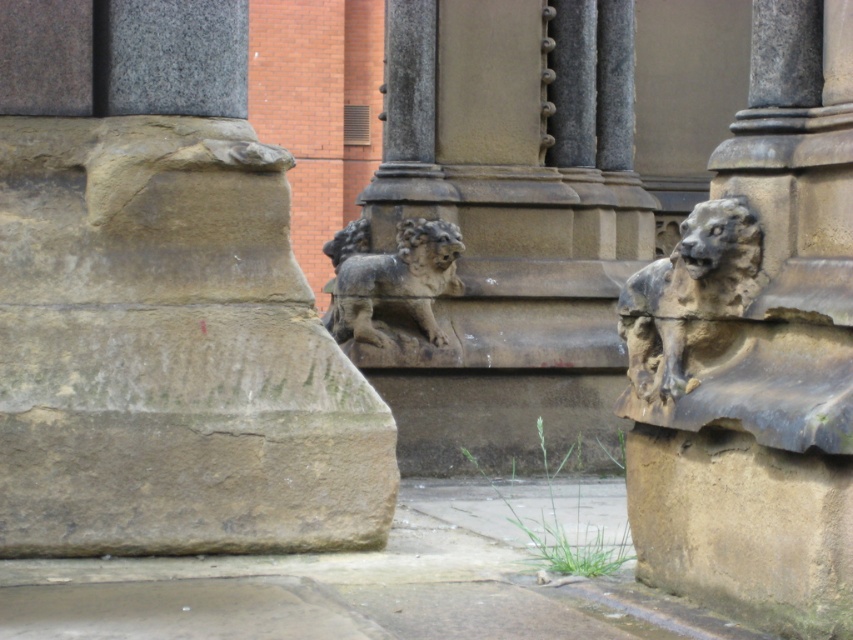
You are an architect examining the stone structure. You notice the rough stone gargoyle at center and the weathered stone lion at right. Which of these two objects is positioned lower in the image?

The rough stone gargoyle at center is located below the weathered stone lion at right, so it is positioned lower in the image.

You are standing at the camera position and want to take a photo of the rough stone gargoyle at center. If your camera has a maximum focus range of 7 meters, will you be able to capture the gargoyle clearly?

The rough stone gargoyle at center is 7.59 meters away from the camera. Since the camera can only focus up to 7 meters, you won cannot capture the gargoyle clearly.

You are an architect examining the stone structure. You notice the rough stone gargoyle at center and the weathered stone lion at right. Which of these two objects is bigger in size?

The rough stone gargoyle at center is larger in size than the weathered stone lion at right.